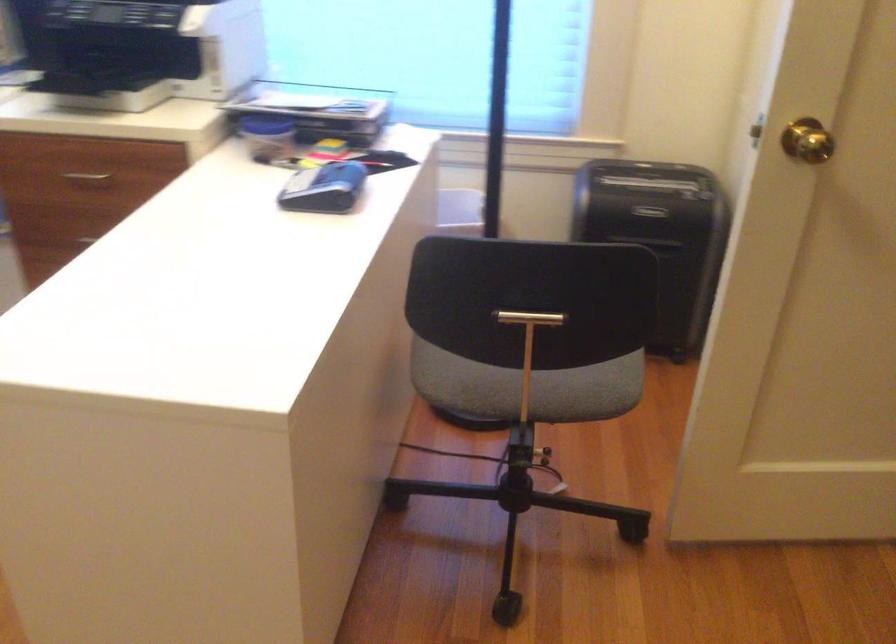
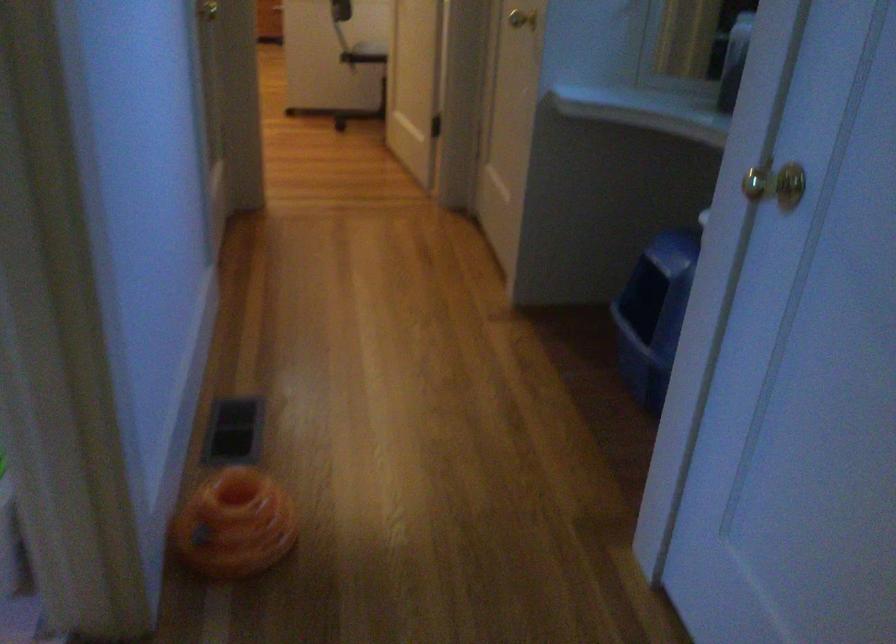
The point at (617, 390) is marked in the first image. Where is the corresponding point in the second image?

(371, 49)